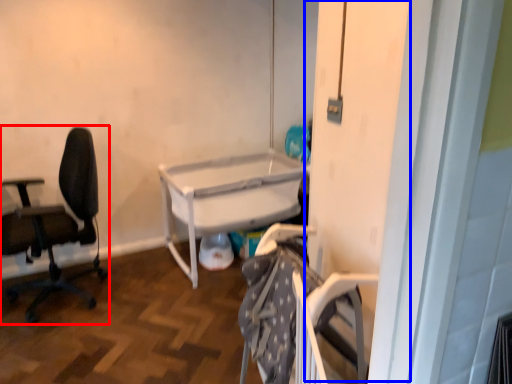
Question: Which object is further to the camera taking this photo, chair (highlighted by a red box) or screen door (highlighted by a blue box)?

Choices:
 (A) chair
 (B) screen door

Answer: (A)